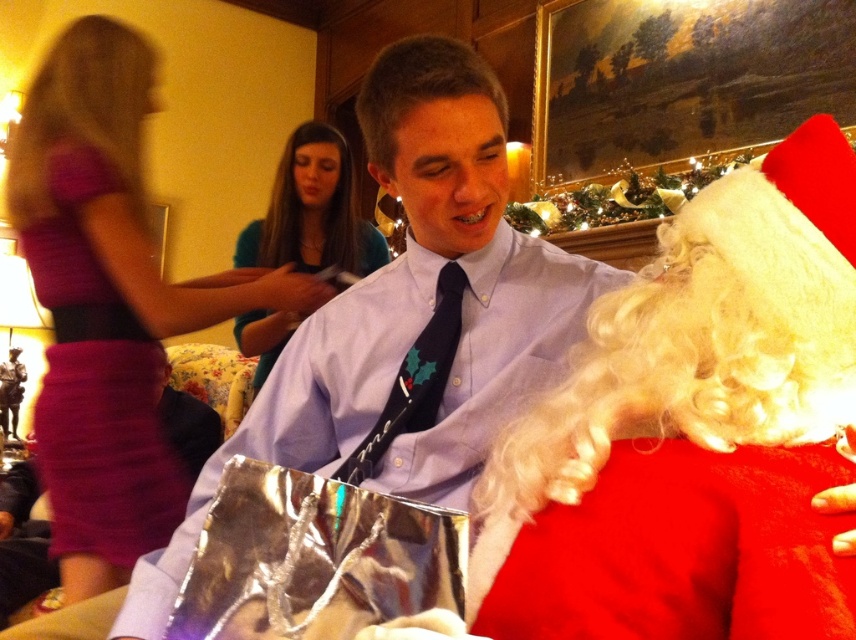
You are standing at point (367, 116) and want to walk to point (414, 394). Is there a clear path between these two points?

Yes, since point (367, 116) is in front of point (414, 394), there is a clear path between them.

You are organizing a holiday photo shoot and need to ensure proper positioning for a group photo. Given the current setup with the teal jersey at center and the black satin tie at center, which item should be moved forward to ensure both are visible in the photo?

The black satin tie at center is currently behind the teal jersey at center. To ensure both are visible, move the black satin tie at center forward so it is in front of the teal jersey at center.